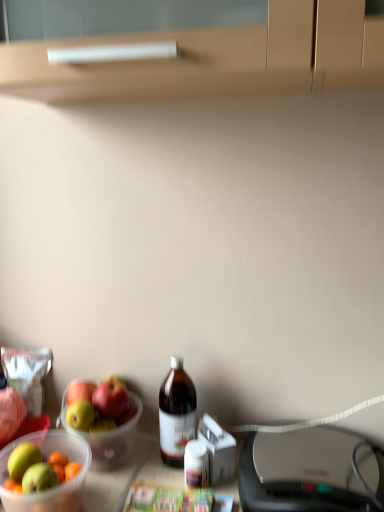
Question: Considering the positions of translucent plastic bowl at lower left and matte black printer at lower right in the image, is translucent plastic bowl at lower left taller or shorter than matte black printer at lower right?

Choices:
 (A) tall
 (B) short

Answer: (A)

Question: Is point (6, 476) closer or farther from the camera than point (324, 480)?

Choices:
 (A) farther
 (B) closer

Answer: (A)

Question: Which object is positioned farthest from the matte black printer at lower right?

Choices:
 (A) brown glass bottle at center
 (B) translucent plastic bowl at lower left

Answer: (B)

Question: Which object is the farthest from the translucent plastic bowl at lower left?

Choices:
 (A) brown glass bottle at center
 (B) matte black printer at lower right

Answer: (B)